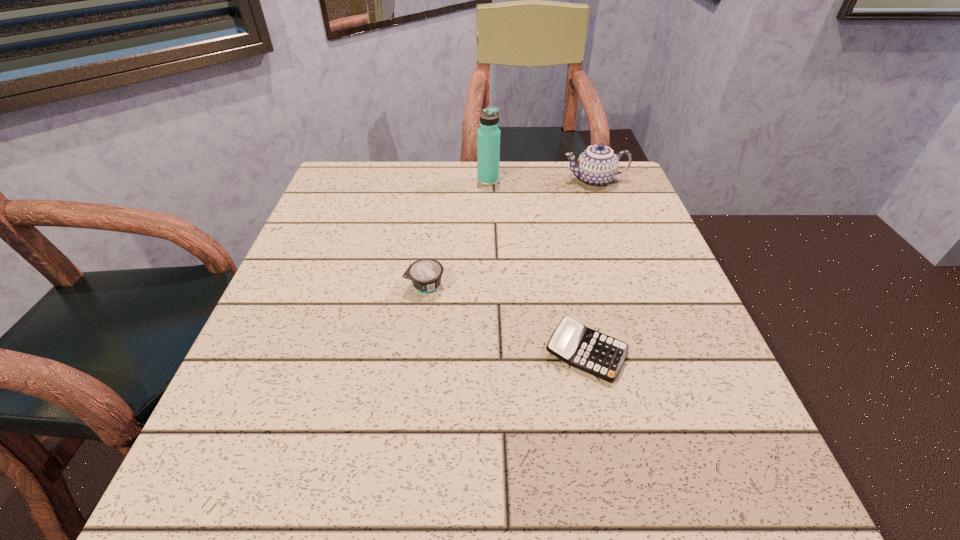
Image resolution: width=960 pixels, height=540 pixels. In order to click on vacant space situated 0.130m from the spout of the second tallest object in this screenshot , I will do `click(514, 180)`.

The width and height of the screenshot is (960, 540). Identify the location of free space located 0.180m on the left of the yogurt. (317, 285).

Find the location of a particular element. This screenshot has width=960, height=540. vacant space located 0.090m on the back of the shortest object is located at coordinates (572, 290).

Find the location of a particular element. thermos bottle that is positioned at the far edge is located at coordinates (488, 135).

Image resolution: width=960 pixels, height=540 pixels. What are the coordinates of `chinaware that is at the far edge` in the screenshot? It's located at (597, 166).

You are a GUI agent. You are given a task and a screenshot of the screen. Output one action in this format:
    pyautogui.click(x=<x>, y=<y>)
    Task: Click on the chinaware that is at the right edge
    This screenshot has height=540, width=960.
    Given the screenshot: What is the action you would take?
    [x=597, y=166]

I want to click on calculator positioned at the right edge, so click(598, 354).

This screenshot has width=960, height=540. In order to click on object located at the far right corner in this screenshot , I will do `click(597, 166)`.

Locate an element on the screen. vacant space at the far edge of the desktop is located at coordinates (428, 179).

The height and width of the screenshot is (540, 960). In the image, there is a desktop. Identify the location of free space at the left edge. (322, 231).